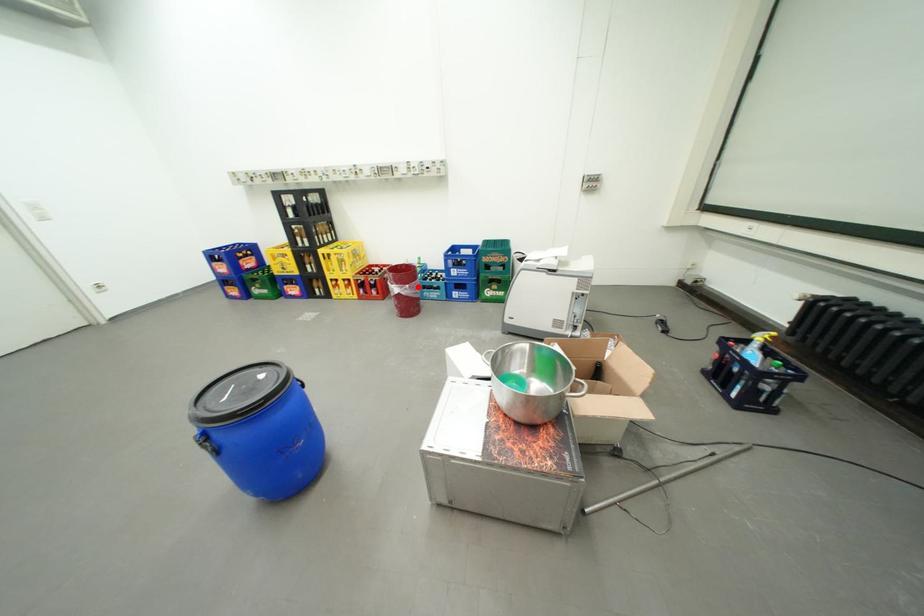
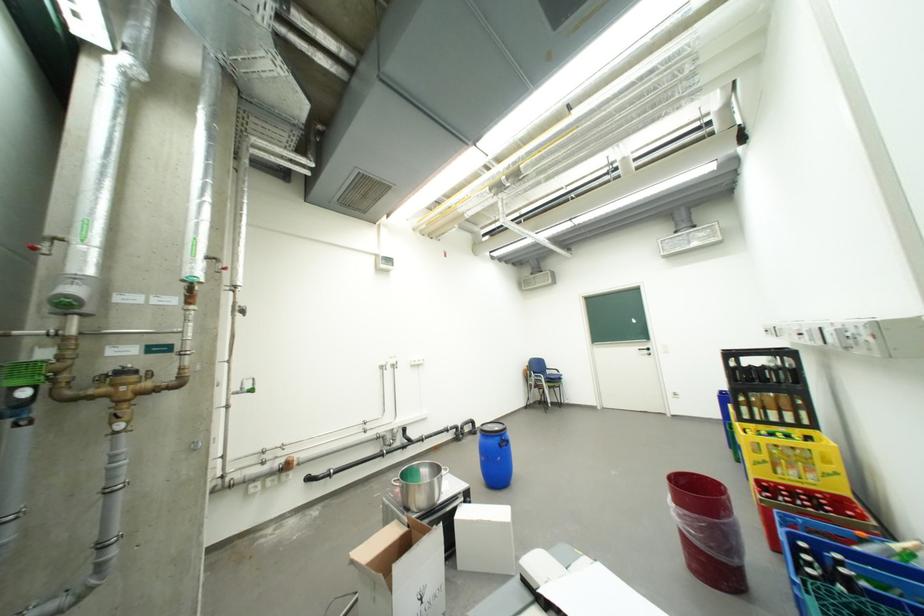
Question: I am providing you with two images of the same scene from different viewpoints. Image1 has a red point marked. In image2, the corresponding 3D location appears at what relative position? Reply with the corresponding letter.

Choices:
 (A) Closer
 (B) Farther

Answer: (B)